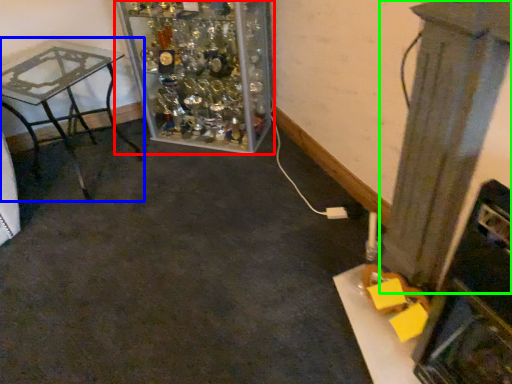
Question: Considering the real-world distances, which object is farthest from furniture (highlighted by a red box)? table (highlighted by a blue box) or pillar (highlighted by a green box)?

Choices:
 (A) table
 (B) pillar

Answer: (B)